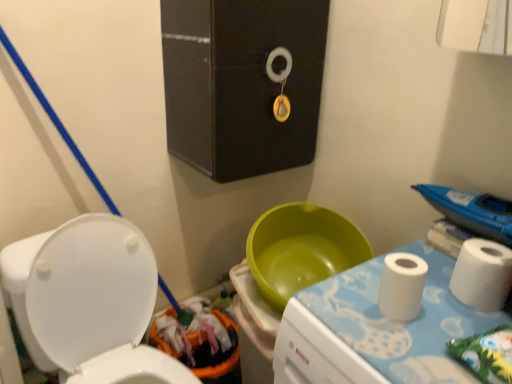
Where is `vacant space that is in between white matte toilet paper at right and white matte toilet paper at right`? Image resolution: width=512 pixels, height=384 pixels. vacant space that is in between white matte toilet paper at right and white matte toilet paper at right is located at coordinates (438, 309).